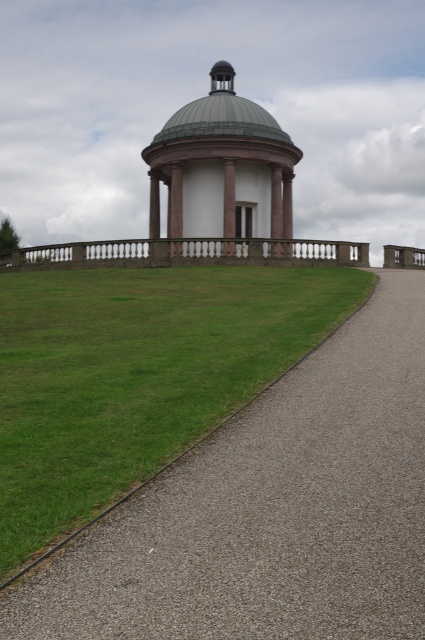
Does gray gravel driveway at center have a greater width compared to pink marble gazebo at center?

In fact, gray gravel driveway at center might be narrower than pink marble gazebo at center.

Which of these two, gray gravel driveway at center or pink marble gazebo at center, stands taller?

With more height is pink marble gazebo at center.

The width and height of the screenshot is (425, 640). I want to click on gray gravel driveway at center, so click(269, 512).

Image resolution: width=425 pixels, height=640 pixels. I want to click on gray gravel driveway at center, so click(x=269, y=512).